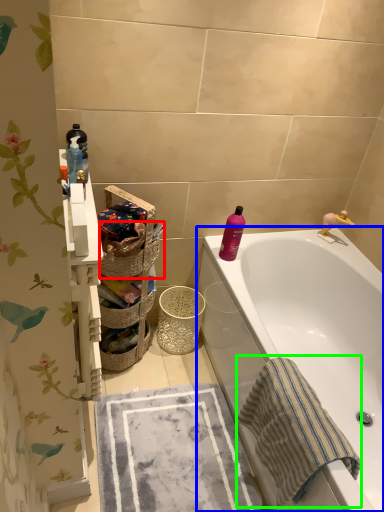
Question: Which object is positioned farthest from basket (highlighted by a red box)? Select from bathtub (highlighted by a blue box) and beach towel (highlighted by a green box).

Choices:
 (A) bathtub
 (B) beach towel

Answer: (B)